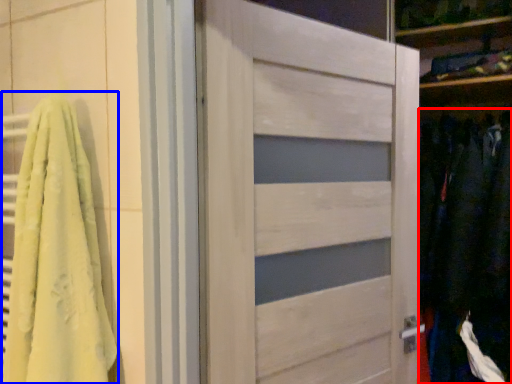
Question: Which of the following is the closest to the observer, clothing (highlighted by a red box) or bath towel (highlighted by a blue box)?

Choices:
 (A) clothing
 (B) bath towel

Answer: (B)